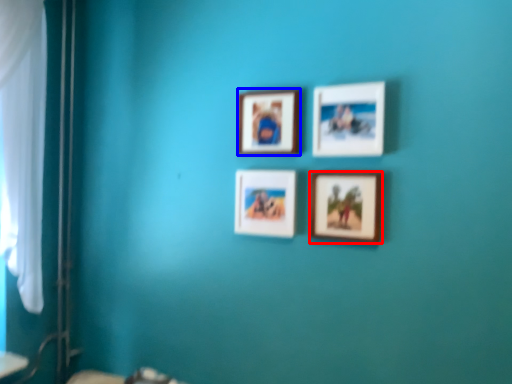
Question: Which of the following is the closest to the observer, picture frame (highlighted by a red box) or picture frame (highlighted by a blue box)?

Choices:
 (A) picture frame
 (B) picture frame

Answer: (A)